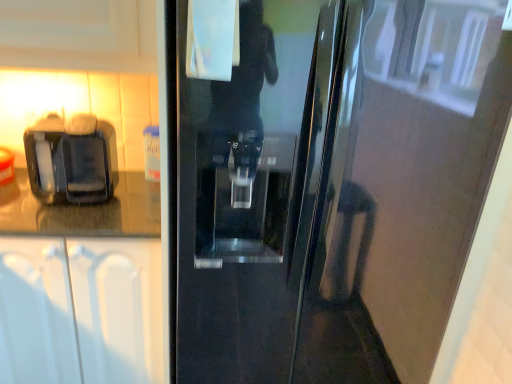
Question: From the image's perspective, is glossy black refrigerator at center located above black plastic coffee machine at left?

Choices:
 (A) no
 (B) yes

Answer: (A)

Question: Is glossy black refrigerator at center bigger than black plastic coffee machine at left?

Choices:
 (A) yes
 (B) no

Answer: (A)

Question: From a real-world perspective, is glossy black refrigerator at center positioned over black plastic coffee machine at left based on gravity?

Choices:
 (A) no
 (B) yes

Answer: (A)

Question: Does glossy black refrigerator at center appear on the left side of black plastic coffee machine at left?

Choices:
 (A) no
 (B) yes

Answer: (A)

Question: Considering the relative sizes of glossy black refrigerator at center and black plastic coffee machine at left in the image provided, is glossy black refrigerator at center taller than black plastic coffee machine at left?

Choices:
 (A) no
 (B) yes

Answer: (B)

Question: Is glossy black refrigerator at center not inside black plastic coffee machine at left?

Choices:
 (A) no
 (B) yes

Answer: (B)

Question: Is white matte cabinet at left positioned far away from glossy black refrigerator at center?

Choices:
 (A) yes
 (B) no

Answer: (B)

Question: Does white matte cabinet at left have a lesser width compared to glossy black refrigerator at center?

Choices:
 (A) no
 (B) yes

Answer: (B)

Question: Is white matte cabinet at left at the right side of glossy black refrigerator at center?

Choices:
 (A) no
 (B) yes

Answer: (A)

Question: Does white matte cabinet at left have a greater height compared to glossy black refrigerator at center?

Choices:
 (A) yes
 (B) no

Answer: (B)

Question: From the image's perspective, is white matte cabinet at left over glossy black refrigerator at center?

Choices:
 (A) no
 (B) yes

Answer: (A)

Question: Is the surface of white matte cabinet at left in direct contact with glossy black refrigerator at center?

Choices:
 (A) no
 (B) yes

Answer: (A)

Question: From a real-world perspective, is white matte cabinet at left on top of black plastic coffee machine at left?

Choices:
 (A) yes
 (B) no

Answer: (B)